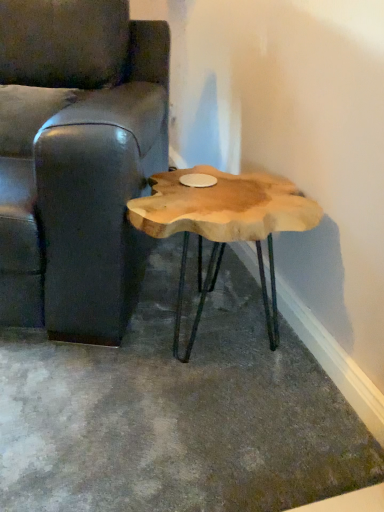
Question: Are natural wood coffee table at center and leather couch at left far apart?

Choices:
 (A) no
 (B) yes

Answer: (A)

Question: Is the depth of natural wood coffee table at center greater than that of leather couch at left?

Choices:
 (A) yes
 (B) no

Answer: (A)

Question: Is natural wood coffee table at center bigger than leather couch at left?

Choices:
 (A) no
 (B) yes

Answer: (A)

Question: Is natural wood coffee table at center smaller than leather couch at left?

Choices:
 (A) yes
 (B) no

Answer: (A)

Question: Is leather couch at left surrounded by natural wood coffee table at center?

Choices:
 (A) yes
 (B) no

Answer: (B)

Question: Does natural wood coffee table at center lie in front of leather couch at left?

Choices:
 (A) yes
 (B) no

Answer: (B)

Question: Considering the relative sizes of leather couch at left and natural wood coffee table at center in the image provided, is leather couch at left bigger than natural wood coffee table at center?

Choices:
 (A) no
 (B) yes

Answer: (B)

Question: Is leather couch at left smaller than natural wood coffee table at center?

Choices:
 (A) no
 (B) yes

Answer: (A)

Question: Considering the relative positions of leather couch at left and natural wood coffee table at center in the image provided, is leather couch at left behind natural wood coffee table at center?

Choices:
 (A) no
 (B) yes

Answer: (A)

Question: From the image's perspective, is leather couch at left located beneath natural wood coffee table at center?

Choices:
 (A) no
 (B) yes

Answer: (A)

Question: Is leather couch at left outside of natural wood coffee table at center?

Choices:
 (A) yes
 (B) no

Answer: (A)

Question: From a real-world perspective, is leather couch at left located beneath natural wood coffee table at center?

Choices:
 (A) no
 (B) yes

Answer: (A)

Question: Is point (160, 73) closer or farther from the camera than point (228, 237)?

Choices:
 (A) closer
 (B) farther

Answer: (B)